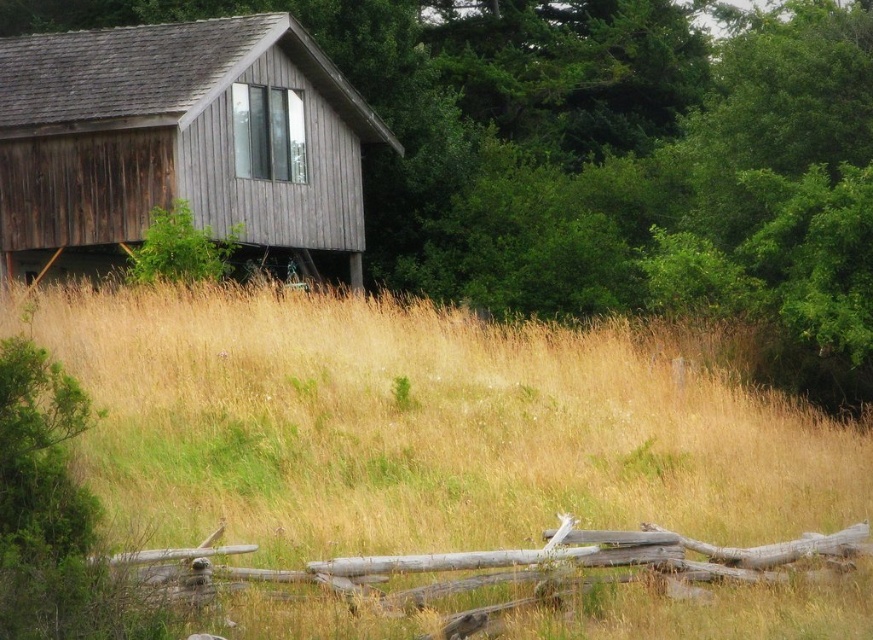
Question: From the image, what is the correct spatial relationship of dry grass at center in relation to green leafy tree at upper center?

Choices:
 (A) below
 (B) above

Answer: (A)

Question: Can you confirm if green leafy tree at upper center is positioned to the right of weathered wood cabin at upper left?

Choices:
 (A) yes
 (B) no

Answer: (A)

Question: Which object appears farthest from the camera in this image?

Choices:
 (A) green leafy tree at upper center
 (B) dry grass at center

Answer: (A)

Question: Is green leafy tree at upper center above weathered wood cabin at upper left?

Choices:
 (A) yes
 (B) no

Answer: (A)

Question: Which object is positioned closest to the green leafy tree at upper center?

Choices:
 (A) dry grass at center
 (B) weathered wood cabin at upper left

Answer: (B)

Question: Which point is closer to the camera taking this photo?

Choices:
 (A) (597, 259)
 (B) (100, 186)
 (C) (301, 385)

Answer: (C)